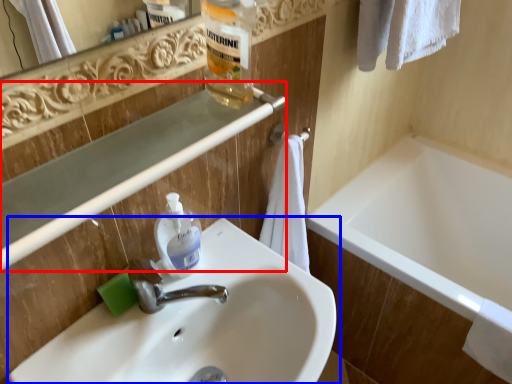
Question: Which object appears closest to the camera in this image, balustrade (highlighted by a red box) or sink (highlighted by a blue box)?

Choices:
 (A) balustrade
 (B) sink

Answer: (A)